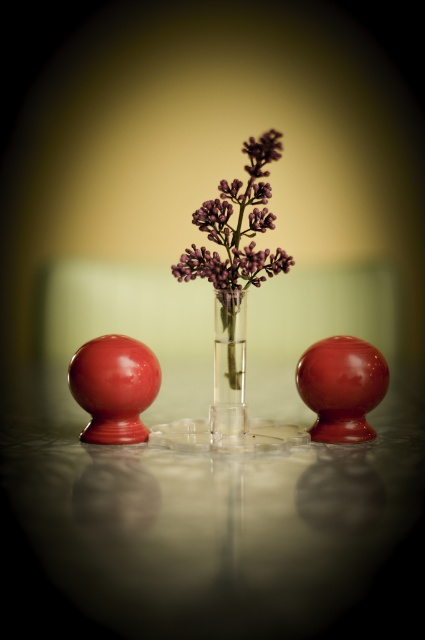
Question: Considering the relative positions of purple matte flower at center and clear glass vase at center in the image provided, where is purple matte flower at center located with respect to clear glass vase at center?

Choices:
 (A) below
 (B) above

Answer: (B)

Question: Among these objects, which one is farthest from the camera?

Choices:
 (A) transparent glass table at center
 (B) clear glass vase at center

Answer: (B)

Question: Is purple matte flower at center bigger than clear glass vase at center?

Choices:
 (A) yes
 (B) no

Answer: (A)

Question: Can you confirm if purple matte flower at center is wider than clear glass vase at center?

Choices:
 (A) no
 (B) yes

Answer: (B)

Question: Considering the real-world distances, which object is farthest from the transparent glass table at center?

Choices:
 (A) purple matte flower at center
 (B) clear glass vase at center

Answer: (A)

Question: Which point appears closest to the camera in this image?

Choices:
 (A) (221, 432)
 (B) (197, 220)

Answer: (B)